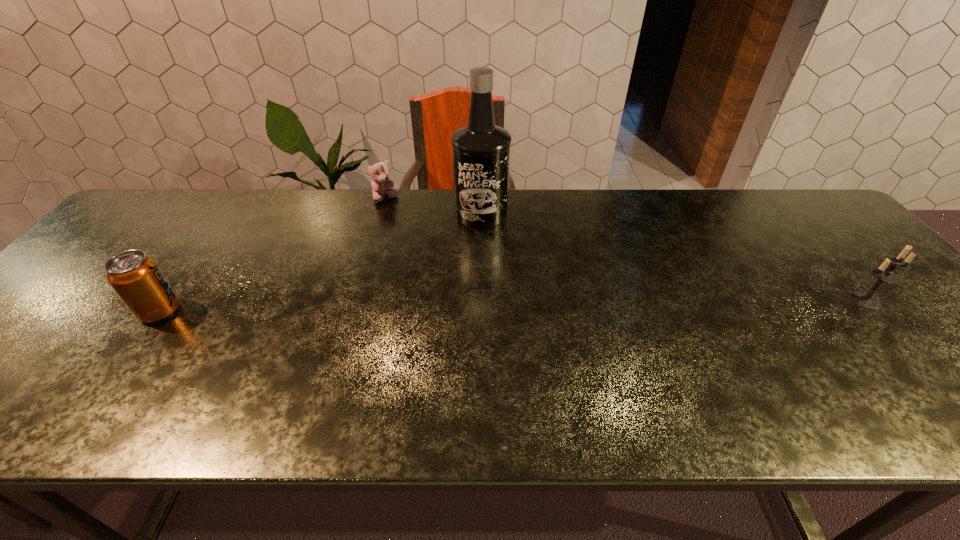
At what (x,y) coordinates should I click in order to perform the action: click on vacant space on the desktop that is between the leftmost object and the rightmost object and is positioned on the front label of the liquor. Please return your answer as a coordinate pair (x, y). The width and height of the screenshot is (960, 540). Looking at the image, I should click on (490, 306).

Find the location of `free spot on the desktop that is between the soda can and the candle holder and is positioned at the face of the third object from right to left`. free spot on the desktop that is between the soda can and the candle holder and is positioned at the face of the third object from right to left is located at coordinates (416, 307).